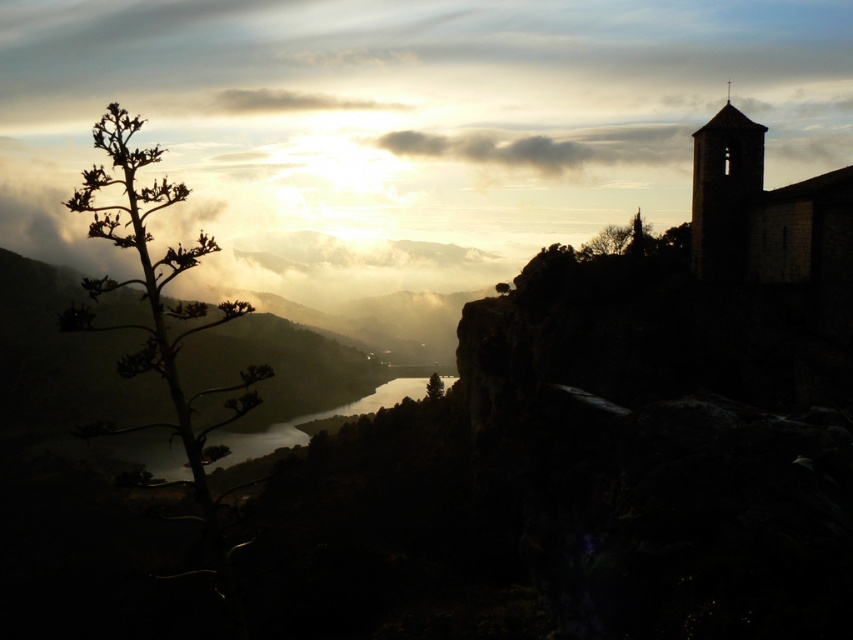
Question: Which object appears closest to the camera in this image?

Choices:
 (A) green leafy tree at center
 (B) white fluffy cloud at upper center

Answer: (A)

Question: Which point is closer to the camera?

Choices:
 (A) dark stone tower at upper right
 (B) silhouette leafy tree at left

Answer: (B)

Question: Can you confirm if dark stone tower at upper right is smaller than glossy reflective water at center?

Choices:
 (A) yes
 (B) no

Answer: (A)

Question: Estimate the real-world distances between objects in this image. Which object is farther from the green leafy tree at center?

Choices:
 (A) silhouette leafy tree at left
 (B) gray fluffy cloud at upper center
 (C) white fluffy cloud at upper center

Answer: (C)

Question: Is gray fluffy cloud at upper center wider than white fluffy cloud at upper center?

Choices:
 (A) no
 (B) yes

Answer: (B)

Question: Does dark stone tower at upper right have a larger size compared to glossy reflective water at center?

Choices:
 (A) yes
 (B) no

Answer: (B)